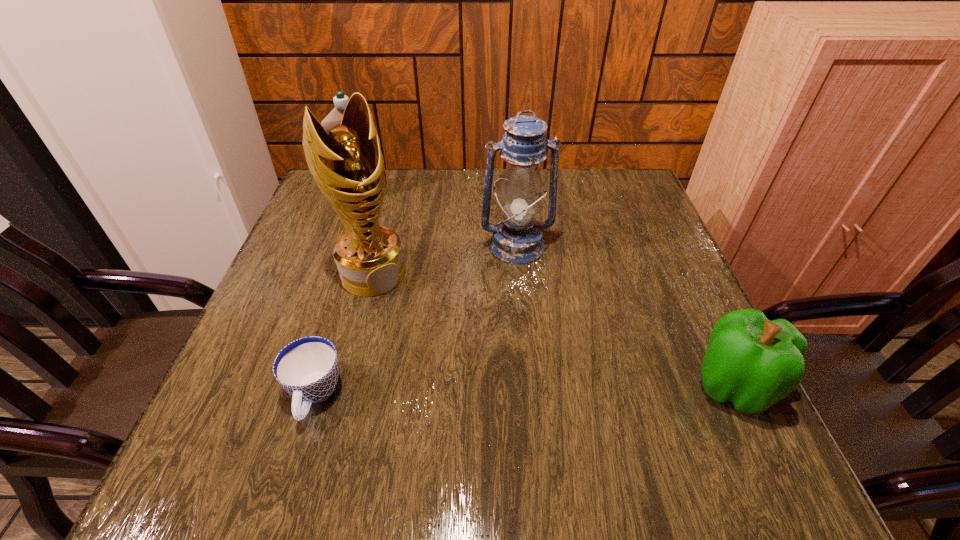
You are a GUI agent. You are given a task and a screenshot of the screen. Output one action in this format:
    pyautogui.click(x=<x>, y=<y>)
    Task: Click on the bell pepper that is at the near edge
    The image size is (960, 540).
    Given the screenshot: What is the action you would take?
    pyautogui.click(x=753, y=362)

Locate an element on the screen. cup that is at the left edge is located at coordinates (308, 368).

The image size is (960, 540). In order to click on award that is at the left edge in this screenshot , I will do `click(347, 164)`.

Where is `detergent that is at the left edge`? detergent that is at the left edge is located at coordinates (334, 118).

What are the coordinates of `object that is at the right edge` in the screenshot? It's located at (753, 362).

Identify the location of object positioned at the far left corner. This screenshot has height=540, width=960. (334, 118).

The width and height of the screenshot is (960, 540). In order to click on object situated at the near left corner in this screenshot , I will do pos(308,368).

Locate an element on the screen. This screenshot has width=960, height=540. object that is at the near right corner is located at coordinates (753, 362).

Identify the location of vacant space at the far edge of the desktop. Image resolution: width=960 pixels, height=540 pixels. (500, 178).

Image resolution: width=960 pixels, height=540 pixels. I want to click on blank space at the near edge of the desktop, so click(x=517, y=397).